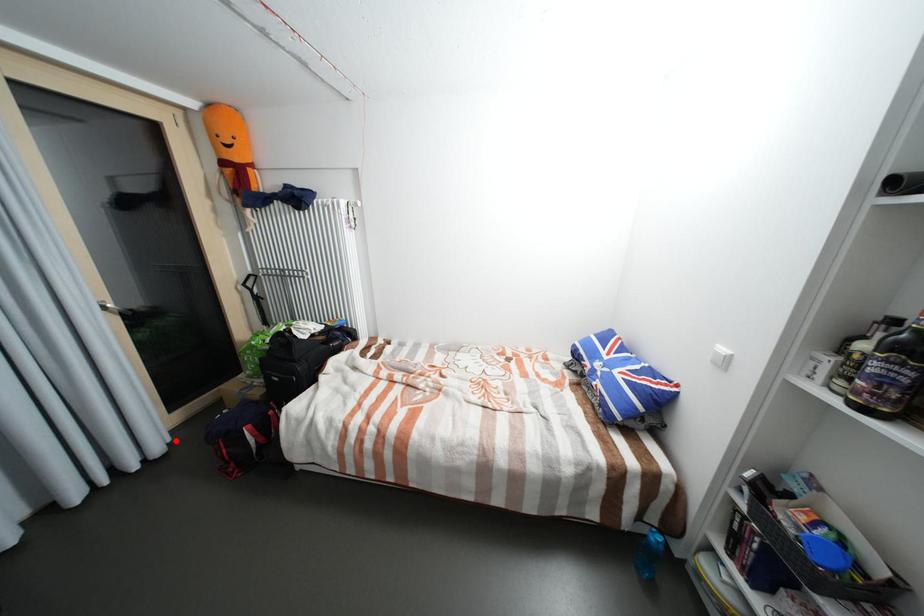
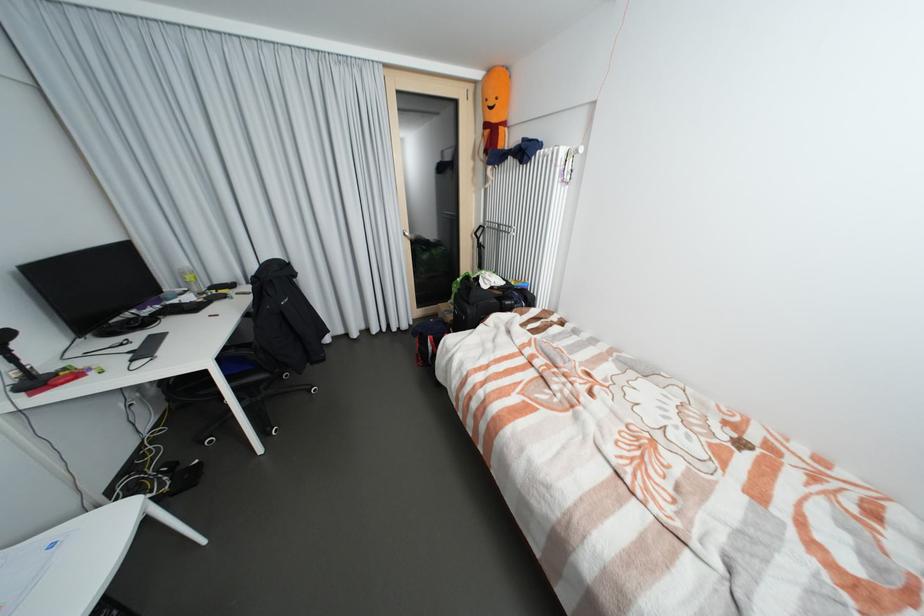
Question: I am providing you with two images of the same scene from different viewpoints. In image1, a red point is highlighted. Considering the same 3D point in image2, which of the following is correct?

Choices:
 (A) It is closer
 (B) It is farther

Answer: (B)